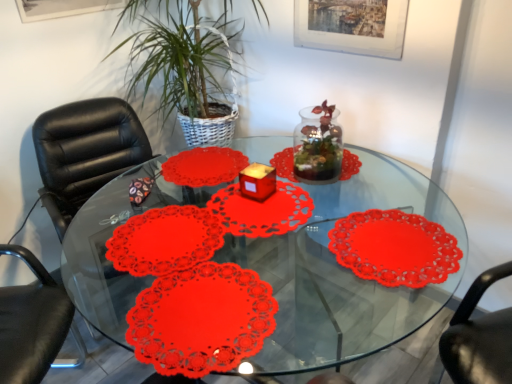
This screenshot has height=384, width=512. I want to click on vacant space to the left of matte red candle holder at center, so pyautogui.click(x=218, y=203).